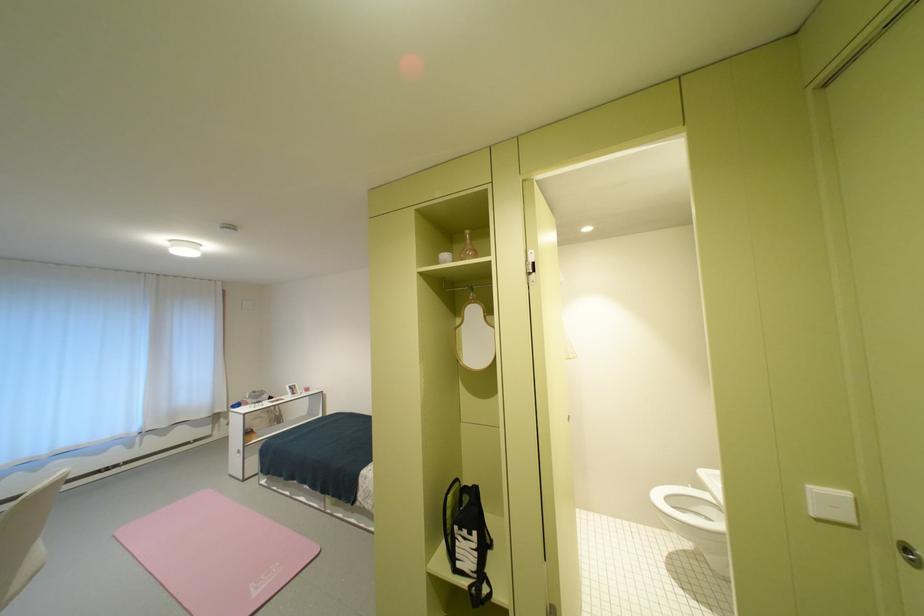
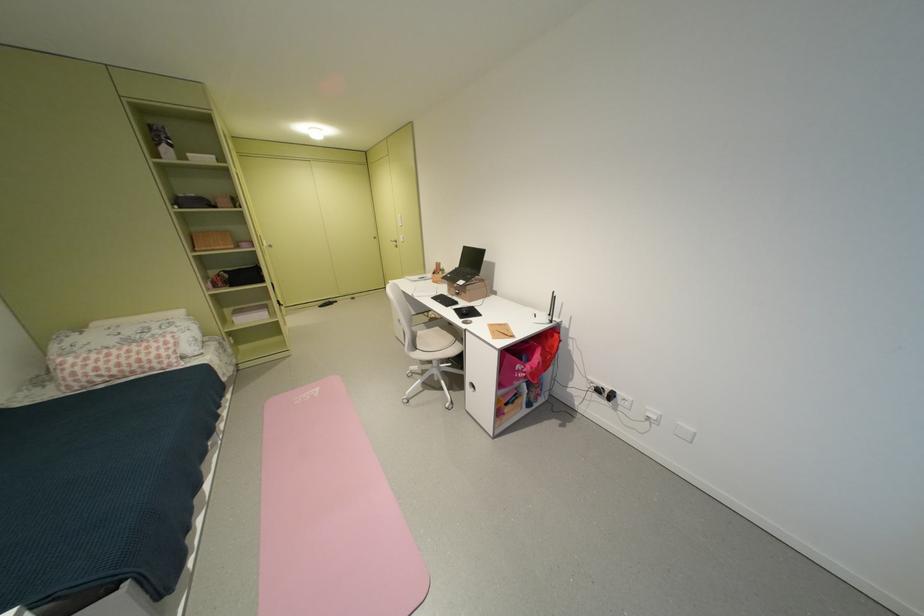
Locate, in the second image, the point that corresponds to point 286,565 in the first image.

(305, 403)